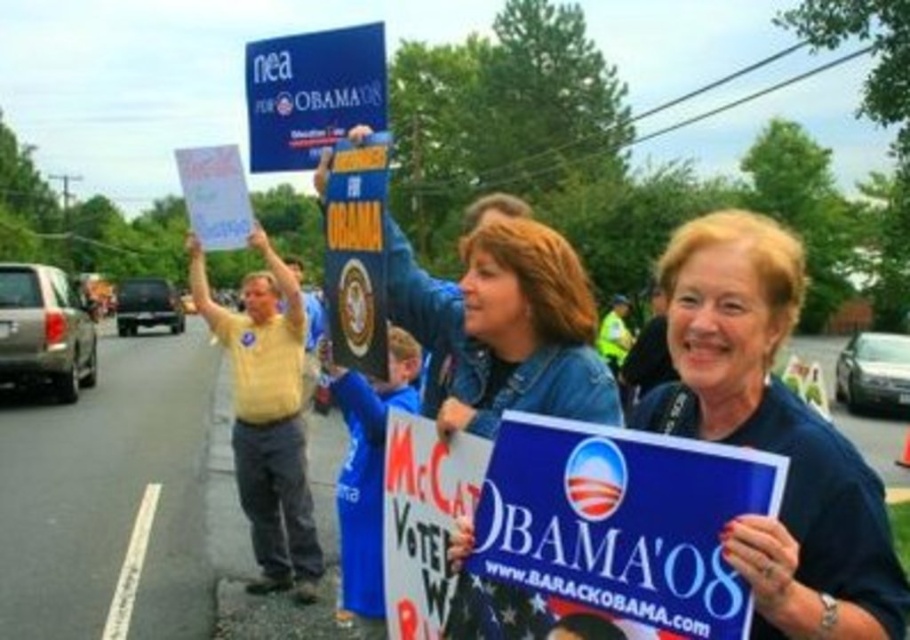
Is blue fabric sign at center wider than blue plastic sign at upper center?

Incorrect, blue fabric sign at center's width does not surpass blue plastic sign at upper center's.

This screenshot has width=910, height=640. What do you see at coordinates (772, 435) in the screenshot?
I see `blue fabric sign at center` at bounding box center [772, 435].

Between point (799, 460) and point (329, 104), which one is positioned behind?

Positioned behind is point (329, 104).

Identify the location of blue fabric sign at center. The image size is (910, 640). (772, 435).

Is yellow shirt at center shorter than blue plastic sign at upper center?

No.

Who is shorter, yellow shirt at center or blue plastic sign at upper center?

blue plastic sign at upper center

Does point (261, 426) come farther from viewer compared to point (361, 109)?

That is True.

Locate an element on the screen. The width and height of the screenshot is (910, 640). yellow shirt at center is located at coordinates (268, 417).

Does blue fabric sign at center have a lesser height compared to yellow shirt at center?

Yes.

Does blue fabric sign at center have a greater width compared to yellow shirt at center?

Incorrect, blue fabric sign at center's width does not surpass yellow shirt at center's.

Image resolution: width=910 pixels, height=640 pixels. Identify the location of blue fabric sign at center. (772, 435).